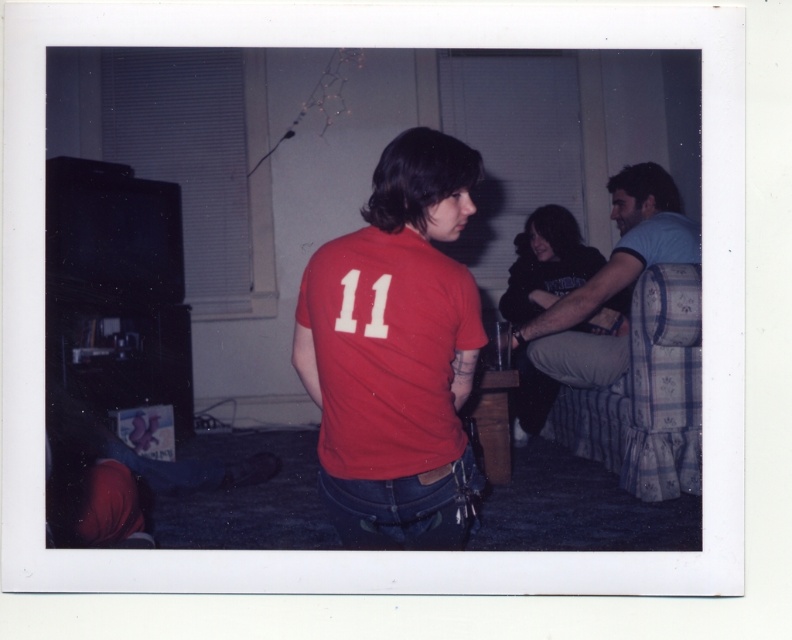
Does matte red t-shirt at center appear on the right side of light blue cotton shirt at right?

Incorrect, matte red t-shirt at center is not on the right side of light blue cotton shirt at right.

Find the location of a particular element. The height and width of the screenshot is (640, 792). matte red t-shirt at center is located at coordinates (387, 352).

I want to click on matte red t-shirt at center, so click(387, 352).